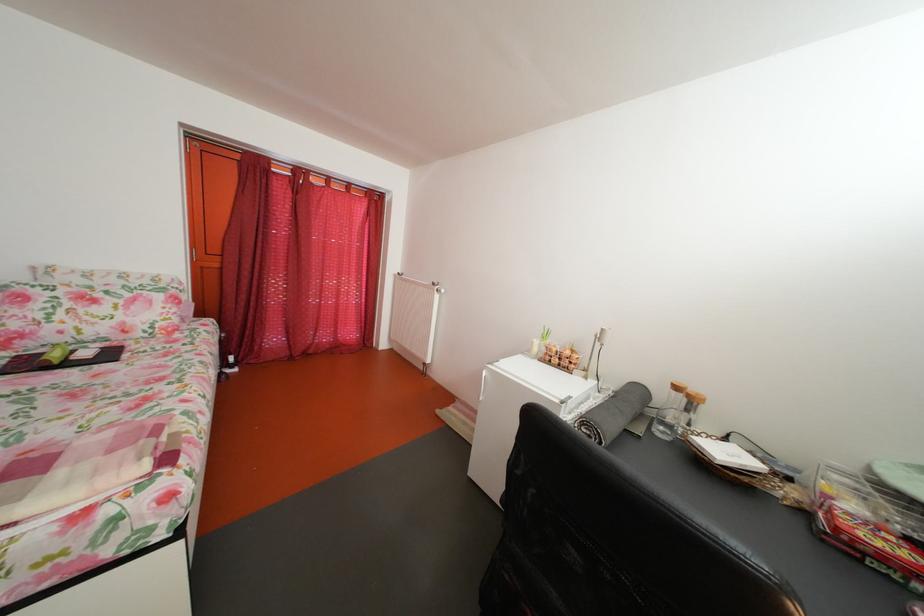
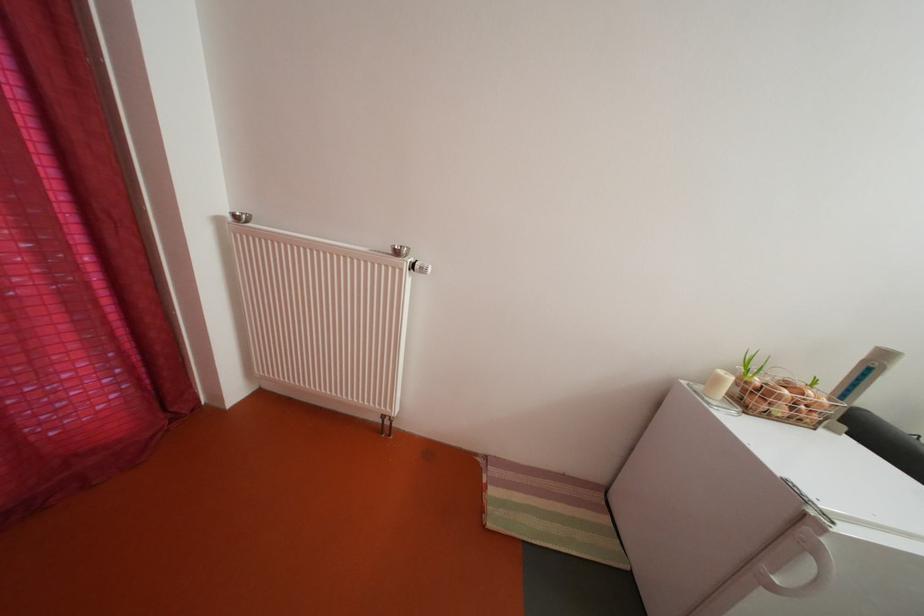
Find the pixel in the second image that matches [566,367] in the first image.

(792, 416)